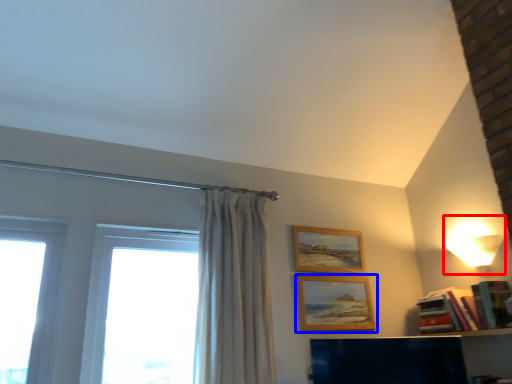
Question: Which object is further to the camera taking this photo, lamp (highlighted by a red box) or picture frame (highlighted by a blue box)?

Choices:
 (A) lamp
 (B) picture frame

Answer: (B)